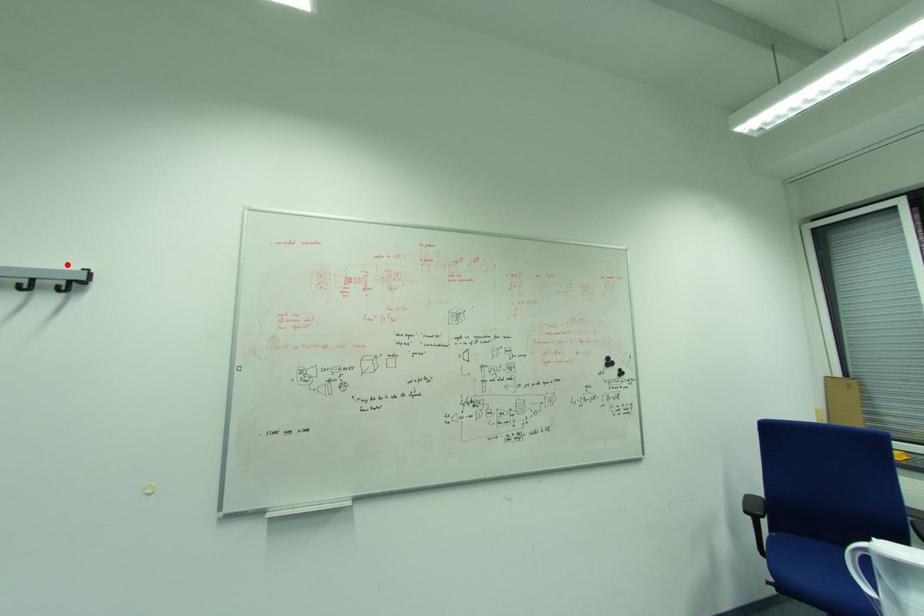
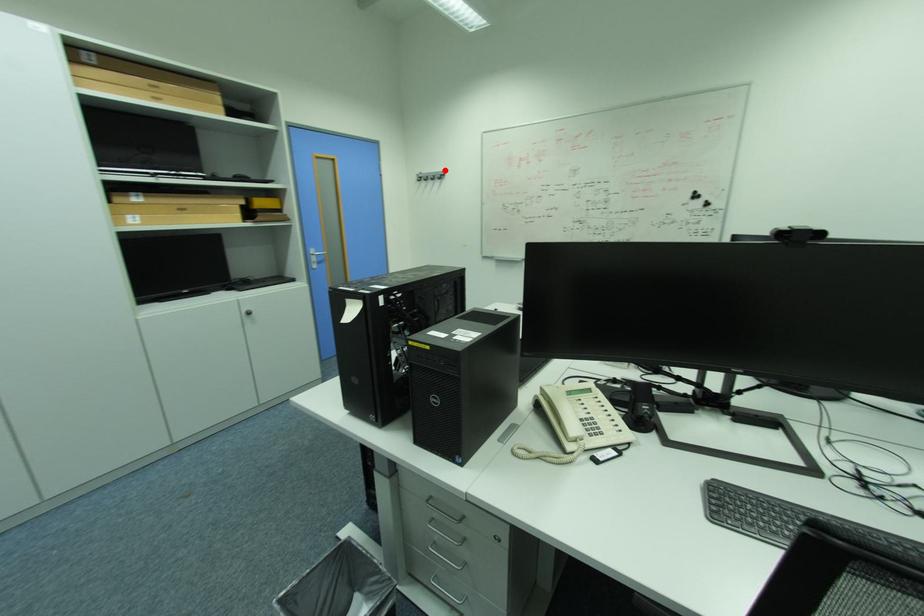
I am providing you with two images of the same scene from different viewpoints. A red point is marked on the first image and another point is marked on the second image. Are the points marked in image1 and image2 representing the same 3D position?

Yes